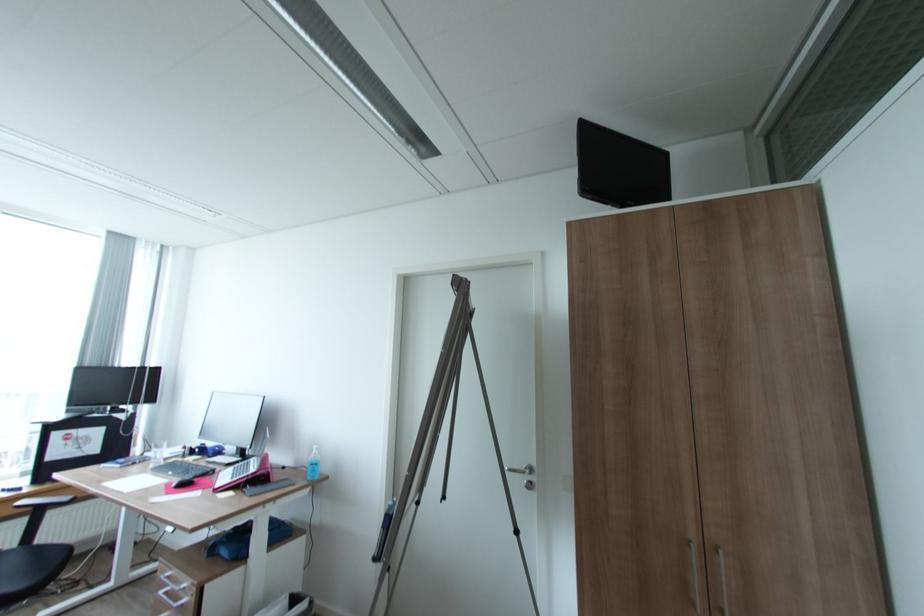
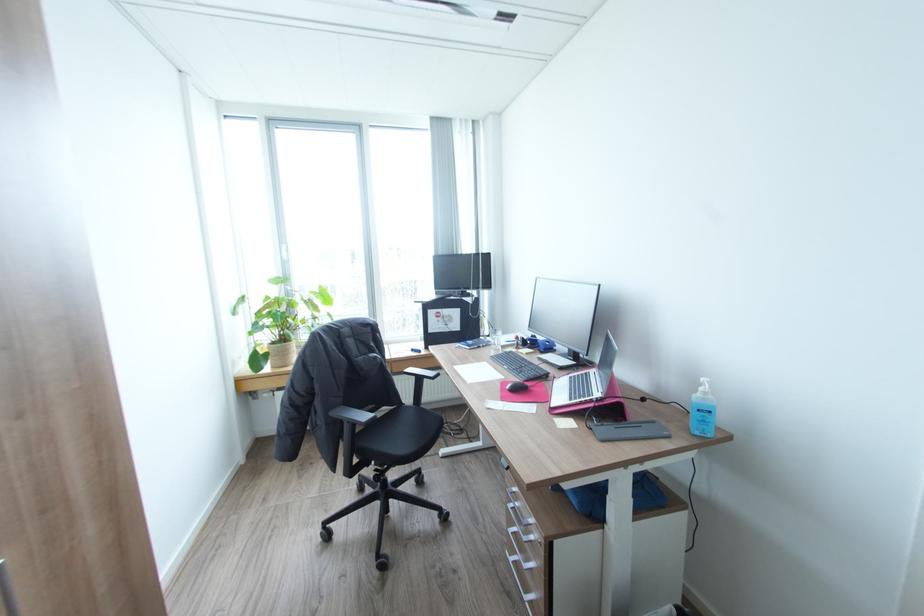
Locate, in the second image, the point that corresponds to point (174, 493) in the first image.

(507, 399)